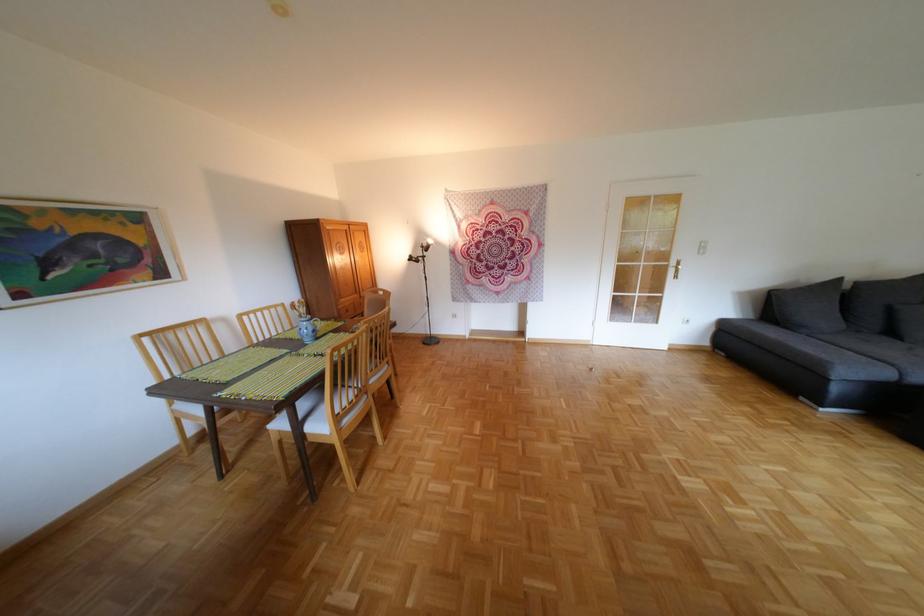
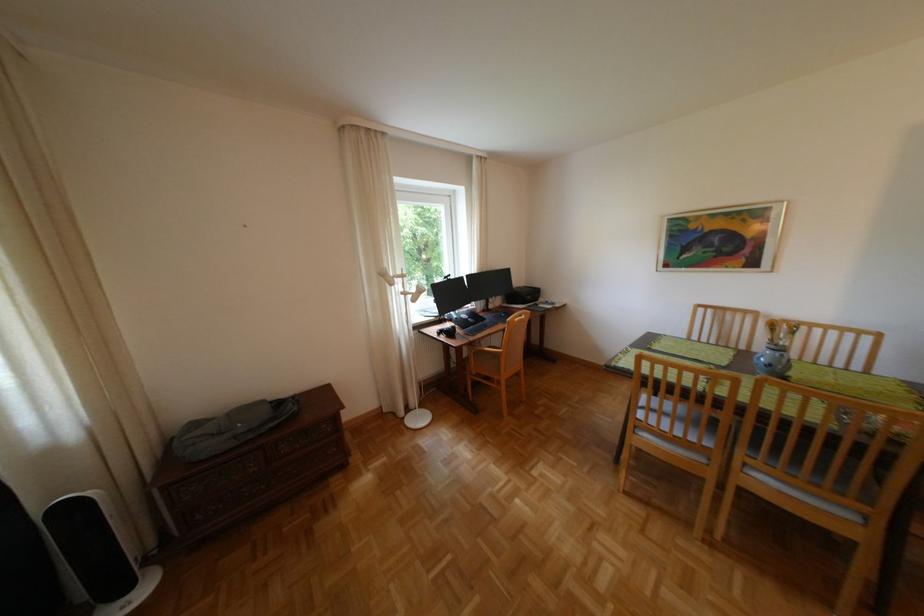
Find the pixel in the second image that matches [326,331] in the first image.

(782, 365)